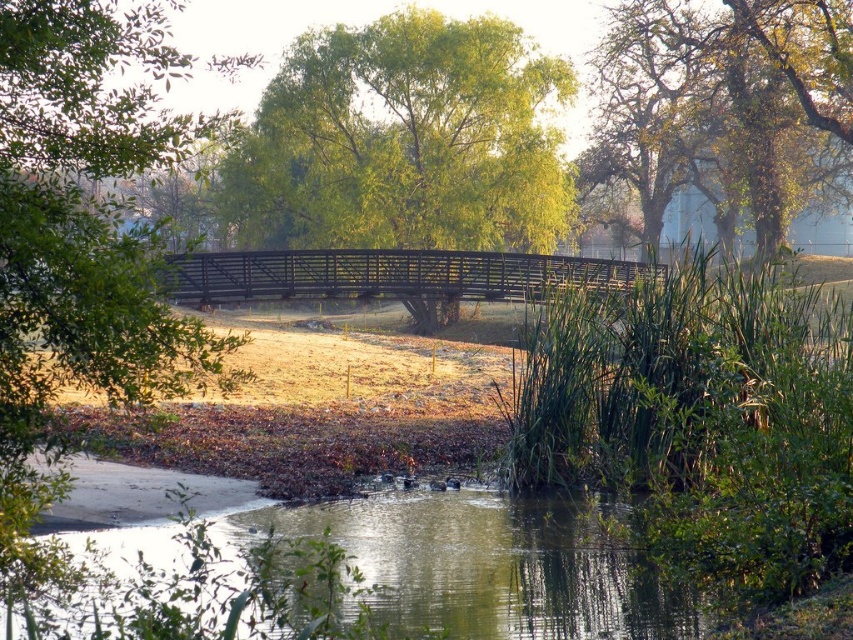
Question: Is the position of green leafy tree at center less distant than that of wooden bridge at center?

Choices:
 (A) yes
 (B) no

Answer: (B)

Question: Which object appears farthest from the camera in this image?

Choices:
 (A) green leafy tree at upper right
 (B) green leafy tree at left
 (C) wooden bridge at center

Answer: (A)

Question: Which object is farther from the camera taking this photo?

Choices:
 (A) green leafy tree at center
 (B) wooden bridge at center
 (C) green leafy tree at upper right

Answer: (A)

Question: Does green leafy tree at left have a greater width compared to wooden bridge at center?

Choices:
 (A) yes
 (B) no

Answer: (A)

Question: Which point is closer to the camera?

Choices:
 (A) green leafy tree at center
 (B) wooden bridge at center

Answer: (B)

Question: Does green leafy tree at center lie in front of wooden bridge at center?

Choices:
 (A) no
 (B) yes

Answer: (A)